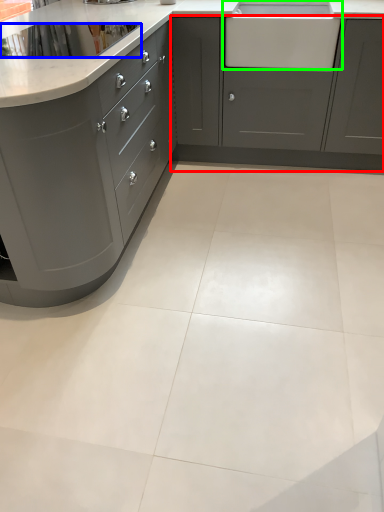
Question: Estimate the real-world distances between objects in this image. Which object is farther from cabinetry (highlighted by a red box), appliance (highlighted by a blue box) or sink (highlighted by a green box)?

Choices:
 (A) appliance
 (B) sink

Answer: (A)